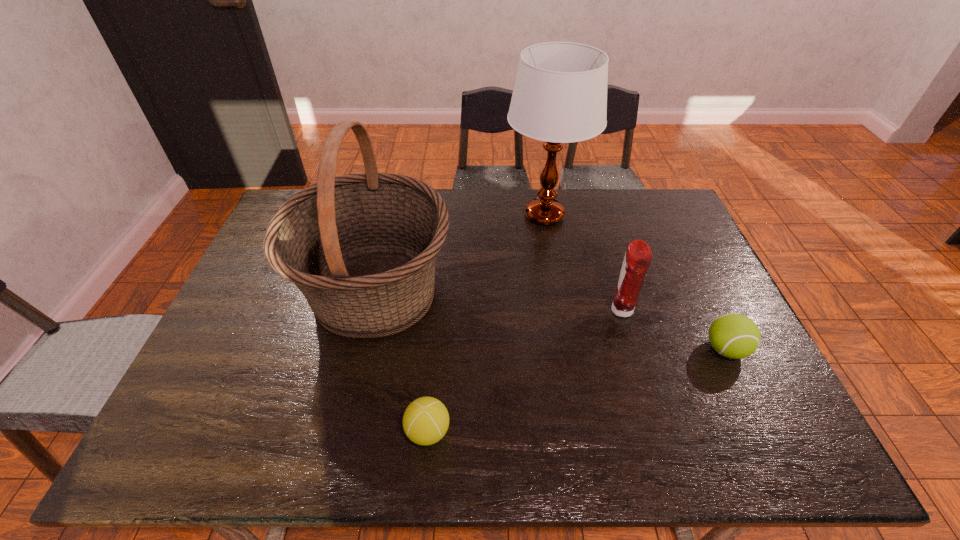
At what (x,y) coordinates should I click in order to perform the action: click on empty space that is in between the rightmost object and the third shortest object. Please return your answer as a coordinate pair (x, y). This screenshot has height=540, width=960. Looking at the image, I should click on (673, 329).

The width and height of the screenshot is (960, 540). I want to click on empty location between the basket and the third tallest object, so click(x=498, y=301).

This screenshot has width=960, height=540. I want to click on object that is the fourth closest to the table lamp, so click(x=426, y=420).

Locate which object ranks second in proximity to the third shortest object. Please provide its 2D coordinates. Your answer should be formatted as a tuple, i.e. [(x, y)], where the tuple contains the x and y coordinates of a point satisfying the conditions above.

[(560, 94)]

Image resolution: width=960 pixels, height=540 pixels. I want to click on vacant point that satisfies the following two spatial constraints: 1. on the back side of the left tennis ball; 2. on the left side of the farther tennis ball, so click(435, 349).

The image size is (960, 540). I want to click on free spot that satisfies the following two spatial constraints: 1. on the back side of the left tennis ball; 2. on the right side of the table lamp, so click(x=446, y=215).

At what (x,y) coordinates should I click in order to perform the action: click on vacant area that satisfies the following two spatial constraints: 1. on the back side of the nearer tennis ball; 2. on the right side of the table lamp. Please return your answer as a coordinate pair (x, y). The height and width of the screenshot is (540, 960). Looking at the image, I should click on (446, 215).

Where is `vacant space that satisfies the following two spatial constraints: 1. on the front side of the condiment; 2. on the right side of the right tennis ball`? Image resolution: width=960 pixels, height=540 pixels. vacant space that satisfies the following two spatial constraints: 1. on the front side of the condiment; 2. on the right side of the right tennis ball is located at coordinates (632, 349).

Locate an element on the screen. free space that satisfies the following two spatial constraints: 1. on the front side of the basket; 2. on the right side of the third shortest object is located at coordinates (372, 310).